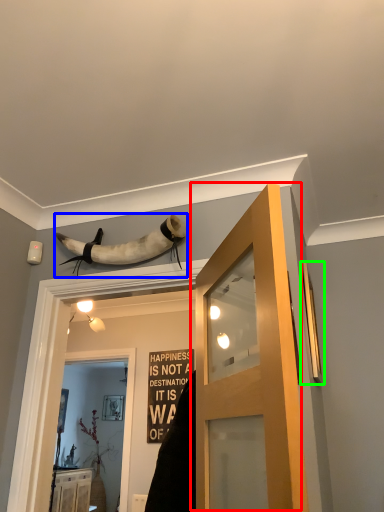
Question: Which object is the closest to the door (highlighted by a red box)? Choose among these: animal (highlighted by a blue box) or window (highlighted by a green box).

Choices:
 (A) animal
 (B) window

Answer: (A)